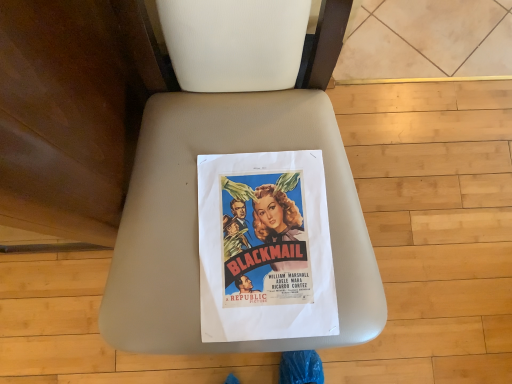
You are a GUI agent. You are given a task and a screenshot of the screen. Output one action in this format:
    pyautogui.click(x=<x>, y=<y>)
    Task: Click on the vacant region to the right of beige leather chair at center
    The width and height of the screenshot is (512, 384).
    Given the screenshot: What is the action you would take?
    pyautogui.click(x=429, y=203)